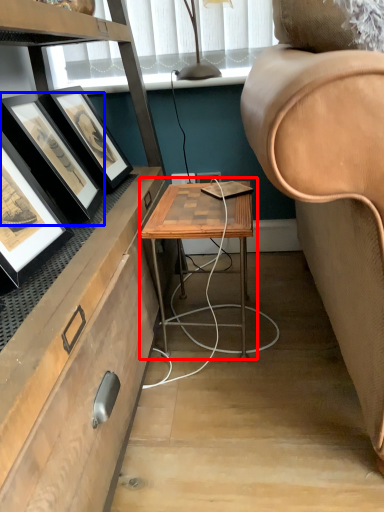
Question: Which point is further to the camera, table (highlighted by a red box) or picture frame (highlighted by a blue box)?

Choices:
 (A) table
 (B) picture frame

Answer: (A)